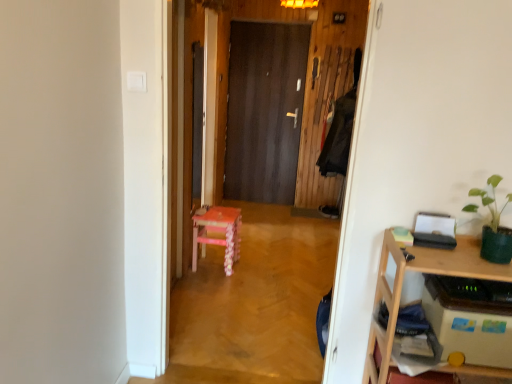
This screenshot has width=512, height=384. In order to click on free point below green matte plant at upper right (from a real-world perspective) in this screenshot , I will do `click(482, 261)`.